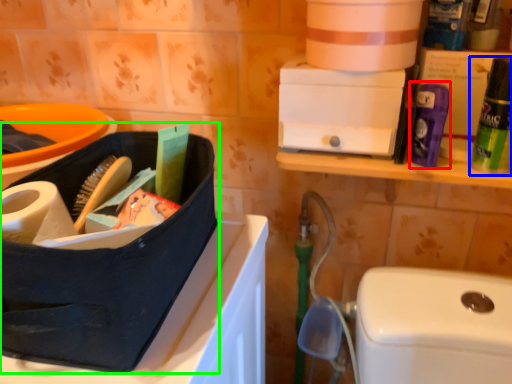
Question: Based on their relative distances, which object is nearer to cleaning product (highlighted by a red box)? Choose from cleaning product (highlighted by a blue box) and lunch box (highlighted by a green box).

Choices:
 (A) cleaning product
 (B) lunch box

Answer: (A)